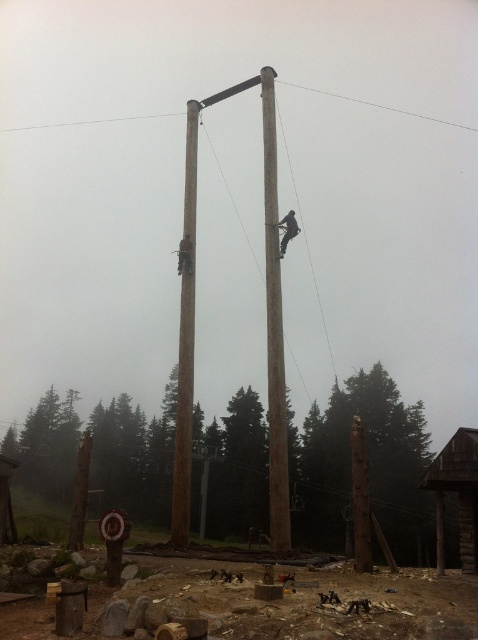
Can you confirm if brown rough wooden post at lower center is taller than wooden pole at center?

Yes, brown rough wooden post at lower center is taller than wooden pole at center.

Between brown rough wooden post at lower center and wooden pole at center, which one is positioned higher?

wooden pole at center

Locate an element on the screen. This screenshot has height=640, width=478. brown rough wooden post at lower center is located at coordinates (368, 465).

Where is `brown rough wooden post at lower center`? This screenshot has height=640, width=478. brown rough wooden post at lower center is located at coordinates (368, 465).

Can you confirm if clear wire at upper center is positioned to the left of dark brown wooden pole at upper center?

No, clear wire at upper center is not to the left of dark brown wooden pole at upper center.

Who is more forward, (330, 97) or (293, 232)?

Point (293, 232)

The image size is (478, 640). Find the location of `clear wire at upper center`. clear wire at upper center is located at coordinates (380, 106).

Is point (57, 451) positioned after point (271, 173)?

Yes, point (57, 451) is behind point (271, 173).

Between brown rough wooden post at lower center and brown wooden telegraph pole at center, which one is positioned lower?

brown rough wooden post at lower center is lower down.

Is point (426, 451) less distant than point (276, 275)?

No, (426, 451) is further to viewer.

The image size is (478, 640). What are the coordinates of `brown rough wooden post at lower center` in the screenshot? It's located at (368, 465).